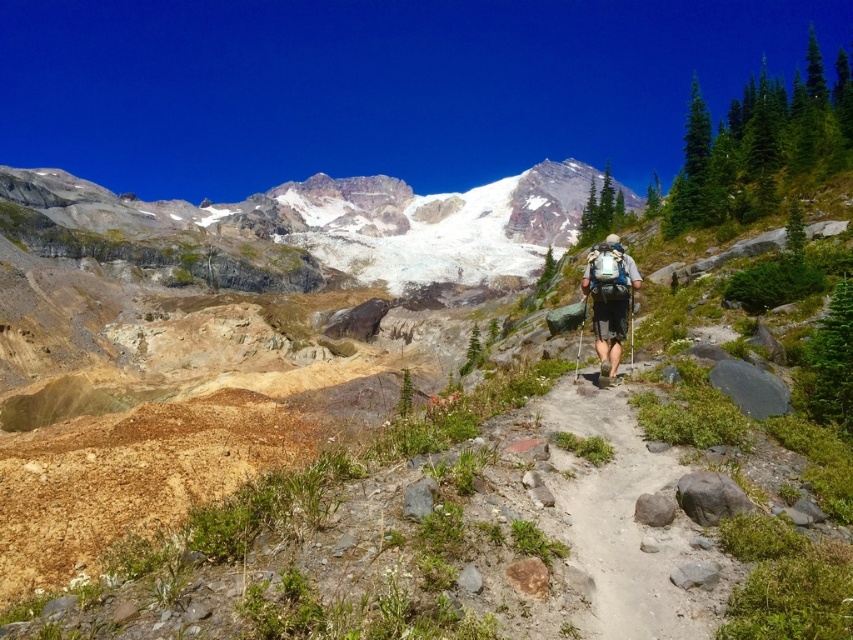
You are a hiker planning to take the dirt path at center to reach the snowy granite mountain at center. Considering the height difference between them, will the mountain be visible from the path once you start ascending?

The snowy granite mountain at center is much taller than the dirt path at center, so yes, the mountain will remain visible from the dirt path at center as you ascend because its height surpasses the path.

You are a hiker planning to take a photo of the snowy granite mountain at center and the matte green backpack at center. Which object should you focus on first if you want both to be in sharp focus?

The snowy granite mountain at center is much taller than the matte green backpack at center, so you should focus on the snowy granite mountain at center first to ensure both are in sharp focus.

You are a hiker planning to place your matte green backpack at center on the dirt path at center. Based on the scene, can you safely put it there?

The dirt path at center and matte green backpack at center are 13.42 meters apart, so placing the matte green backpack at center on the dirt path at center is possible as they are separated by that distance.